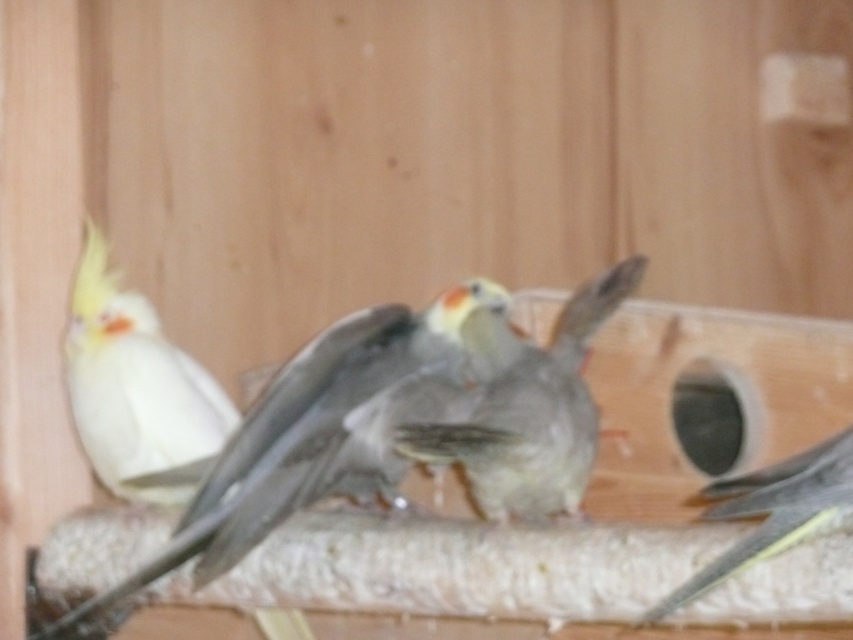
You are standing in front of the cockatiels and want to place a treat exactly at point (334,451). If your hand is 3 feet away from the birds, can you reach that point without moving closer?

The point (334,451) is 3.82 feet away from the viewer. Since your hand is only 3 feet away, you cannot reach the point without moving closer.

Based on the scene description, where is the white feathered parrot at left located in terms of its 2D coordinates?

The white feathered parrot at left is located at the 2D coordinates of point (136,388).

You are a bird enthusiast observing the cockatiels in their enclosure. You notice the white feathered parrot at left and the gray feathered bird at center. Which of these birds is sitting higher up in the wooden structure?

The white feathered parrot at left is positioned over the gray feathered bird at center, so it is sitting higher up in the wooden structure.